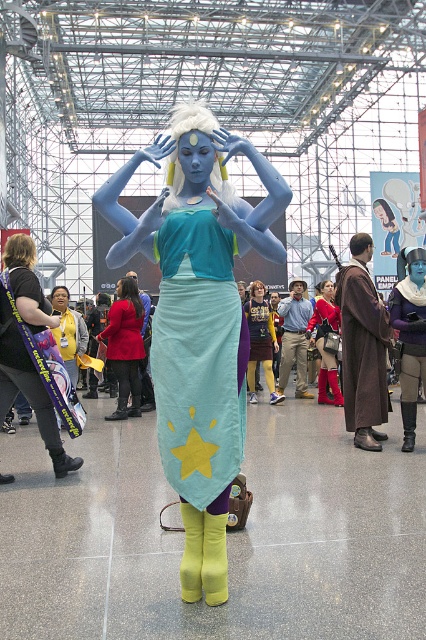
Can you confirm if matte blue skirt at center is positioned to the right of matte black jacket at center?

Yes, matte blue skirt at center is to the right of matte black jacket at center.

Does matte blue skirt at center appear under matte black jacket at center?

Indeed, matte blue skirt at center is positioned under matte black jacket at center.

Is point (259, 323) farther from viewer compared to point (86, 328)?

Yes, point (259, 323) is farther from viewer.

At what (x,y) coordinates should I click in order to perform the action: click on matte blue skirt at center. Please return your answer as a coordinate pair (x, y). Looking at the image, I should click on (259, 340).

How distant is matte red coat at center from shiny red boots at center?

matte red coat at center is 3.42 meters away from shiny red boots at center.

Which of these two, matte red coat at center or shiny red boots at center, stands taller?

With more height is matte red coat at center.

Which is behind, point (109, 356) or point (330, 371)?

The point (330, 371) is behind.

Locate an element on the screen. matte red coat at center is located at coordinates coord(124,346).

Who is higher up, matte black banner at left or matte black jacket at center?

matte black jacket at center is above.

Can you confirm if matte black banner at left is thinner than matte black jacket at center?

Incorrect, matte black banner at left's width is not less than matte black jacket at center's.

The width and height of the screenshot is (426, 640). I want to click on matte black banner at left, so click(x=23, y=376).